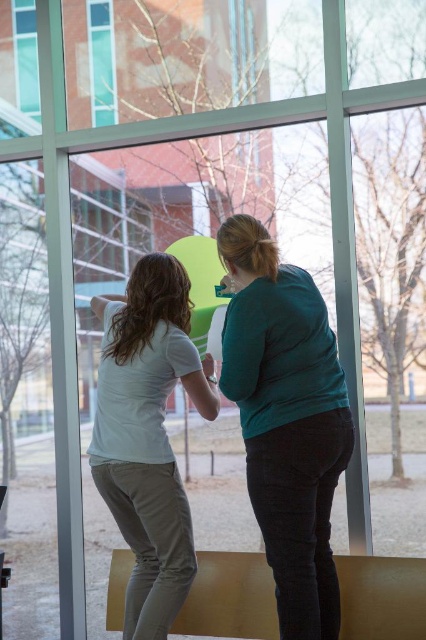
Question: Which of these objects is positioned farthest from the teal matte shirt at center?

Choices:
 (A) transparent glass table at lower center
 (B) white matte shirt at center

Answer: (A)

Question: Which object appears closest to the camera in this image?

Choices:
 (A) transparent glass table at lower center
 (B) white matte shirt at center
 (C) teal matte shirt at center

Answer: (C)

Question: Can you confirm if teal matte shirt at center is smaller than white matte shirt at center?

Choices:
 (A) no
 (B) yes

Answer: (A)

Question: Which point is closer to the camera?

Choices:
 (A) transparent glass table at lower center
 (B) teal matte shirt at center
 (C) white matte shirt at center

Answer: (B)

Question: Is teal matte shirt at center to the right of white matte shirt at center from the viewer's perspective?

Choices:
 (A) no
 (B) yes

Answer: (B)

Question: Does teal matte shirt at center appear under transparent glass table at lower center?

Choices:
 (A) yes
 (B) no

Answer: (B)